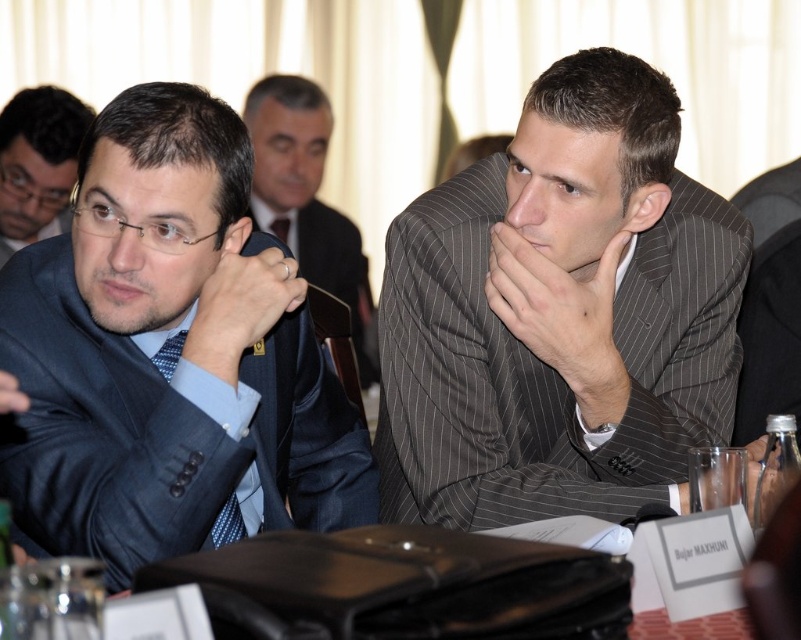
Question: Where is gray pinstripe suit at center located in relation to dark blue suit at center in the image?

Choices:
 (A) right
 (B) left

Answer: (A)

Question: In this image, where is gray pinstripe suit at center located relative to dark blue suit at center?

Choices:
 (A) right
 (B) left

Answer: (A)

Question: Which object is positioned closest to the matte black suit at left?

Choices:
 (A) matte blue suit at left
 (B) dark blue suit at center
 (C) gray pinstripe suit at center

Answer: (B)

Question: Which point is closer to the camera?

Choices:
 (A) (353, 442)
 (B) (321, 284)

Answer: (A)

Question: Can you confirm if gray pinstripe suit at center is positioned to the right of matte black suit at left?

Choices:
 (A) yes
 (B) no

Answer: (A)

Question: Which point is farther from the camera taking this photo?

Choices:
 (A) (252, 116)
 (B) (638, 132)

Answer: (A)